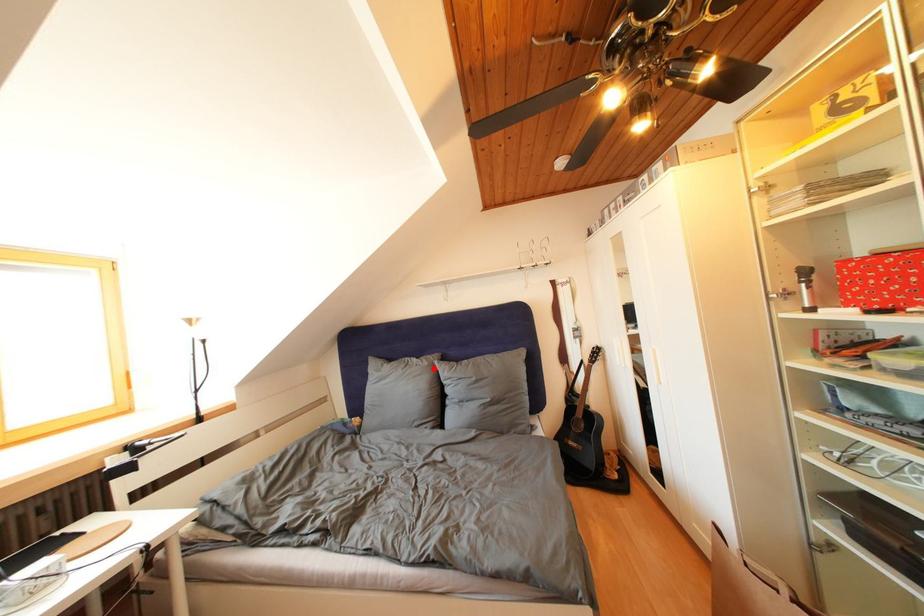
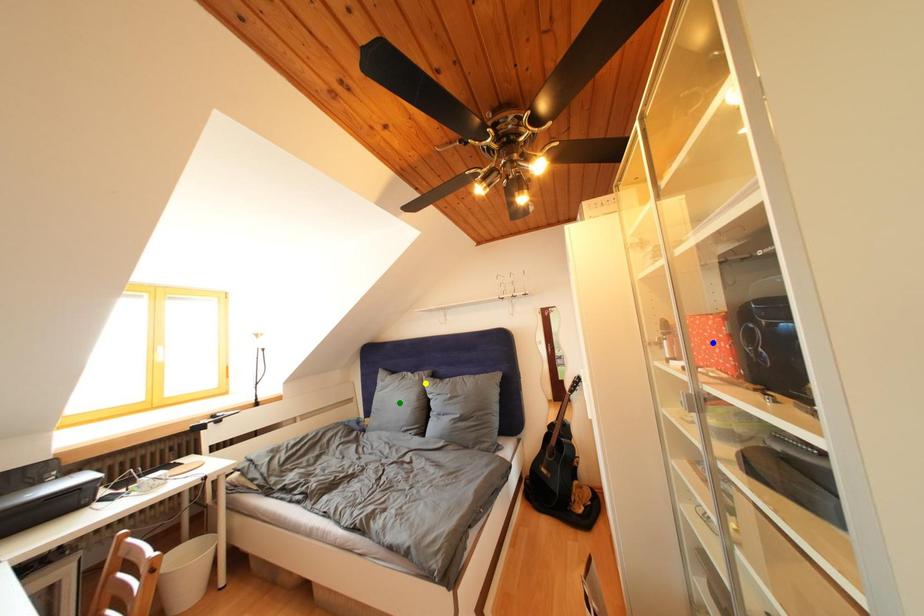
Question: I am providing you with two images of the same scene from different viewpoints. A red point is marked on the first image. You are given multiple points on the second image. Which spot in image 2 lines up with the point in image 1?

Choices:
 (A) green point
 (B) blue point
 (C) yellow point

Answer: (C)